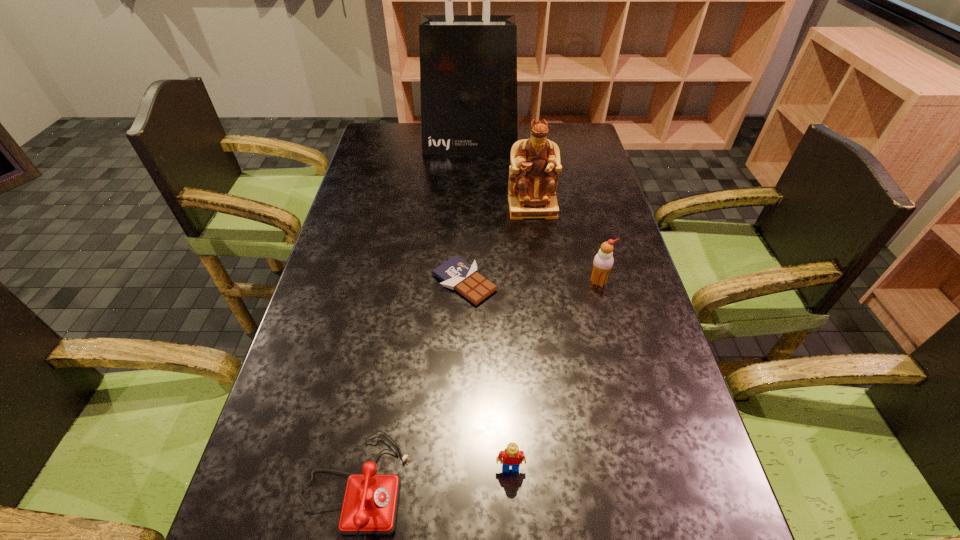
Locate an element on the screen. empty space that is in between the farthest object and the chocolate bar is located at coordinates (468, 213).

The height and width of the screenshot is (540, 960). Find the location of `vacant space that's between the shortest object and the icecream`. vacant space that's between the shortest object and the icecream is located at coordinates (532, 282).

Find the location of a particular element. free spot between the rightmost object and the shortest object is located at coordinates (532, 282).

Locate an element on the screen. unoccupied position between the Lego and the chocolate bar is located at coordinates (488, 375).

Locate an element on the screen. vacant area that lies between the second tallest object and the rightmost object is located at coordinates (565, 245).

The width and height of the screenshot is (960, 540). I want to click on empty location between the shopping bag and the Lego, so click(x=491, y=306).

You are a GUI agent. You are given a task and a screenshot of the screen. Output one action in this format:
    pyautogui.click(x=<x>, y=<y>)
    Task: Click on the closest object to the shortest object
    The image size is (960, 540).
    Given the screenshot: What is the action you would take?
    pyautogui.click(x=535, y=165)

Where is `object that is the closest to the telephone`? This screenshot has width=960, height=540. object that is the closest to the telephone is located at coordinates (511, 456).